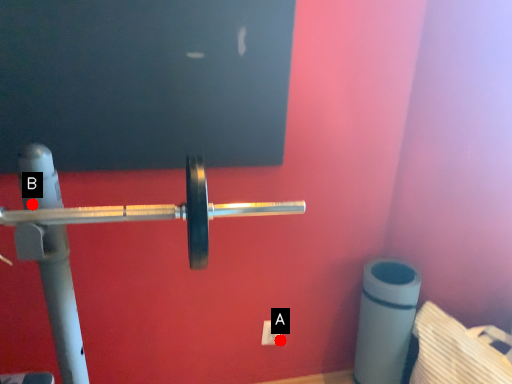
Question: Two points are circled on the image, labeled by A and B beside each circle. Which point is farther to the camera?

Choices:
 (A) A is further
 (B) B is further

Answer: (A)